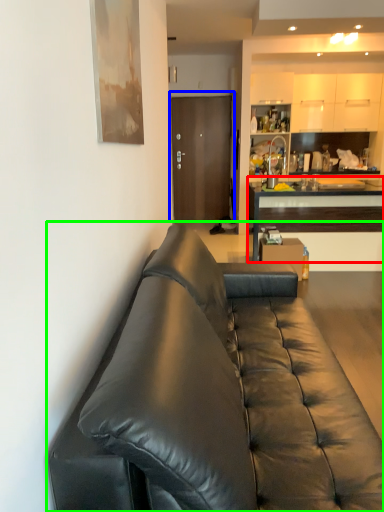
Question: Which object is positioned closest to cabinetry (highlighted by a red box)? Select from door (highlighted by a blue box) and studio couch (highlighted by a green box).

Choices:
 (A) door
 (B) studio couch

Answer: (A)